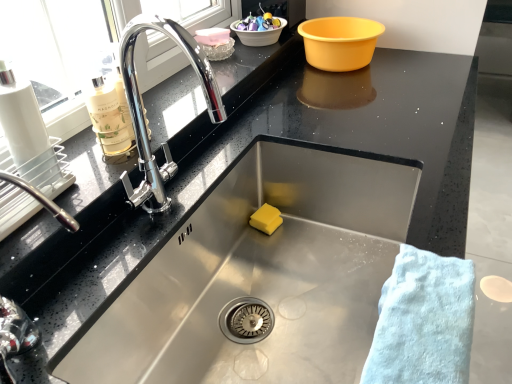
Question: Is translucent plastic bowl at upper center, which ranks as the 3th basin in right-to-left order, wider or thinner than polished chrome tap at left?

Choices:
 (A) thin
 (B) wide

Answer: (B)

Question: From a real-world perspective, is translucent plastic bowl at upper center, which ranks as the 3th basin in right-to-left order, physically located above or below polished chrome tap at left?

Choices:
 (A) below
 (B) above

Answer: (A)

Question: Which object is positioned farthest from the white plastic basin at upper center, positioned as the second basin in right-to-left order?

Choices:
 (A) translucent glass bottle at left
 (B) pink plastic container at upper center, the second food in the front-to-back sequence
 (C) yellow sponge at sink bottom, positioned as the third food in back-to-front order
 (D) translucent plastic bowl at upper center, acting as the first basin starting from the left
 (E) polished chrome tap at left

Answer: (E)

Question: Which is farther from the glossy ceramic bowl at upper center, the first food when ordered from top to bottom?

Choices:
 (A) yellow plastic basin at upper right, positioned as the third basin in left-to-right order
 (B) translucent glass bottle at left
 (C) pink plastic container at upper center, the second food in the front-to-back sequence
 (D) translucent plastic bowl at upper center, acting as the first basin starting from the left
 (E) white plastic basin at upper center, positioned as the second basin in right-to-left order

Answer: (B)